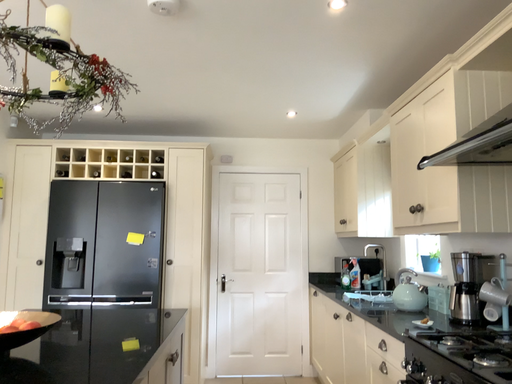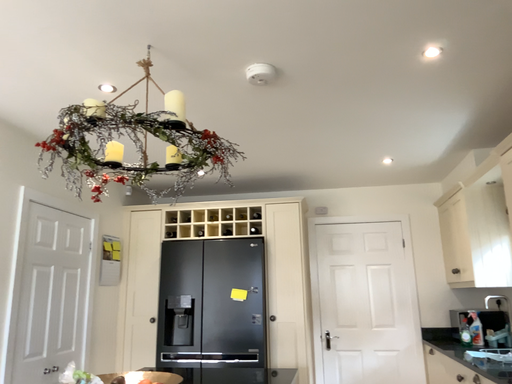
Question: How did the camera likely rotate when shooting the video?

Choices:
 (A) rotated downward
 (B) rotated upward

Answer: (B)